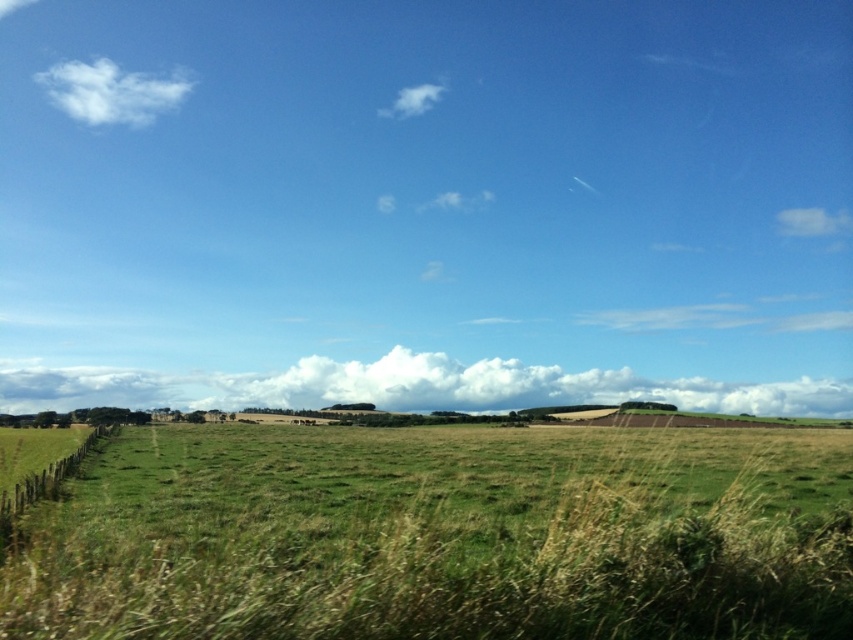
Does white fluffy cloud at center lie in front of white fluffy cloud at upper left?

That is True.

Who is more forward, [711,403] or [51,80]?

Positioned in front is point [711,403].

Identify the location of white fluffy cloud at center. (410, 387).

Looking at this image, is green grassy field at center to the right of white fluffy cloud at upper right from the viewer's perspective?

In fact, green grassy field at center is to the left of white fluffy cloud at upper right.

Who is taller, green grassy field at center or white fluffy cloud at upper right?

green grassy field at center

Where is `green grassy field at center`? This screenshot has width=853, height=640. green grassy field at center is located at coordinates (440, 534).

Between white fluffy cloud at upper left and white fluffy cloud at upper center, which one is positioned higher?

white fluffy cloud at upper left is above.

Who is taller, white fluffy cloud at upper left or white fluffy cloud at upper center?

white fluffy cloud at upper left

Which is behind, point (73, 76) or point (408, 109)?

Positioned behind is point (73, 76).

This screenshot has height=640, width=853. Identify the location of white fluffy cloud at upper left. (111, 92).